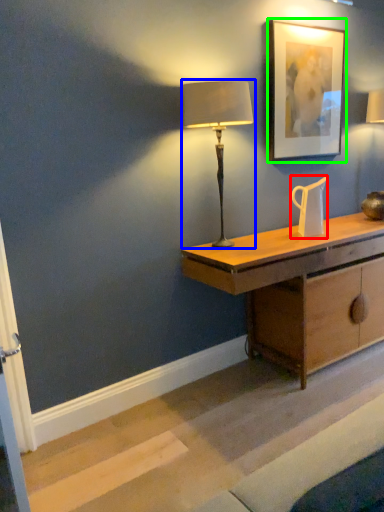
Question: Which object is the closest to the jug (highlighted by a red box)? Choose among these: lamp (highlighted by a blue box) or picture frame (highlighted by a green box).

Choices:
 (A) lamp
 (B) picture frame

Answer: (B)